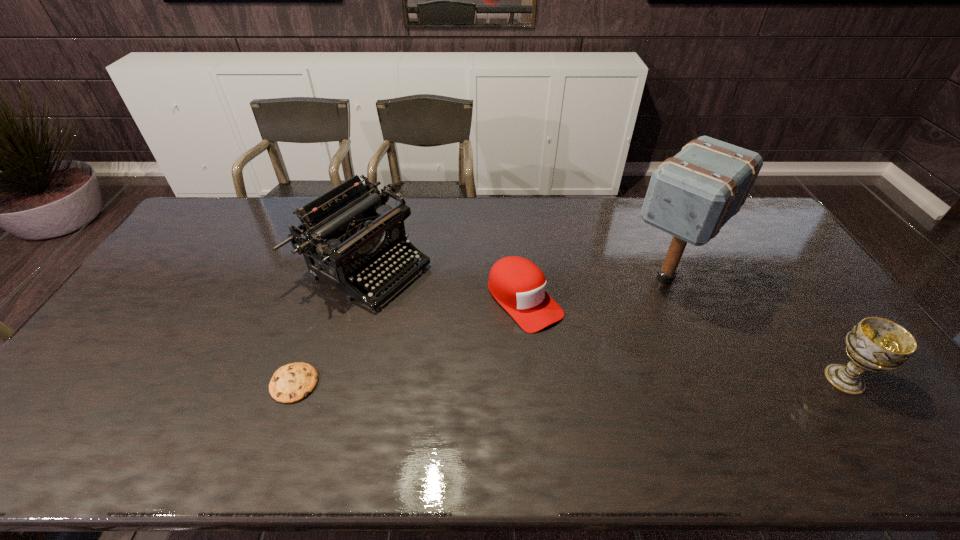
The image size is (960, 540). Find the location of `free space located on the keyboard of the typewriter`. free space located on the keyboard of the typewriter is located at coordinates (486, 328).

Where is `vacant space situated 0.050m on the keyboard of the typewriter`? The image size is (960, 540). vacant space situated 0.050m on the keyboard of the typewriter is located at coordinates (428, 298).

Locate an element on the screen. The width and height of the screenshot is (960, 540). vacant region located on the keyboard of the typewriter is located at coordinates (519, 346).

Locate an element on the screen. The image size is (960, 540). free space located 0.100m on the front-facing side of the baseball cap is located at coordinates coord(571,353).

Find the location of `vacant area situated 0.110m on the front-facing side of the baseball cap`. vacant area situated 0.110m on the front-facing side of the baseball cap is located at coordinates (574, 355).

Find the location of a particular element. This screenshot has width=960, height=540. free space located 0.100m on the front-facing side of the baseball cap is located at coordinates (571, 353).

Locate an element on the screen. vacant space located 0.170m on the striking surface of the tallest object is located at coordinates (611, 336).

I want to click on vacant space located 0.120m on the striking surface of the tallest object, so (620, 326).

Where is `vacant space situated on the striking surface of the tallest object`? vacant space situated on the striking surface of the tallest object is located at coordinates (624, 322).

Where is `object at the far edge`? This screenshot has width=960, height=540. object at the far edge is located at coordinates (349, 233).